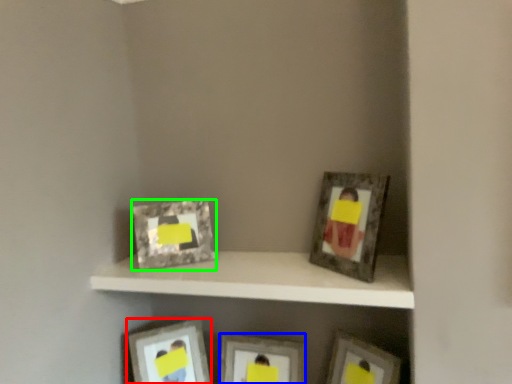
Question: Estimate the real-world distances between objects in this image. Which object is closer to picture frame (highlighted by a red box), picture frame (highlighted by a blue box) or picture frame (highlighted by a green box)?

Choices:
 (A) picture frame
 (B) picture frame

Answer: (A)